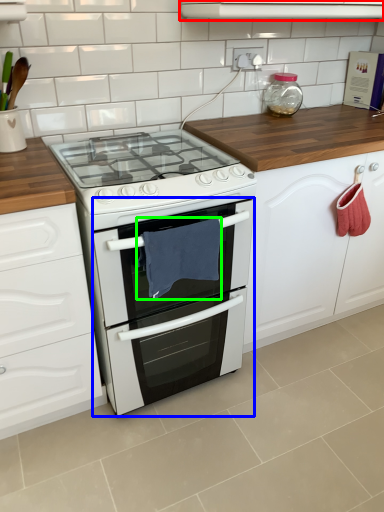
Question: Which is nearer to the vent (highlighted by a red box)? oven (highlighted by a blue box) or material (highlighted by a green box).

Choices:
 (A) oven
 (B) material

Answer: (B)